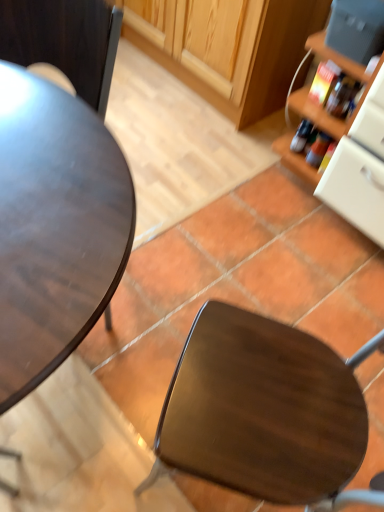
Locate an element on the screen. This screenshot has width=384, height=512. vacant area that lies between wooden cabinet at upper center and shiny brown chair at center is located at coordinates (205, 194).